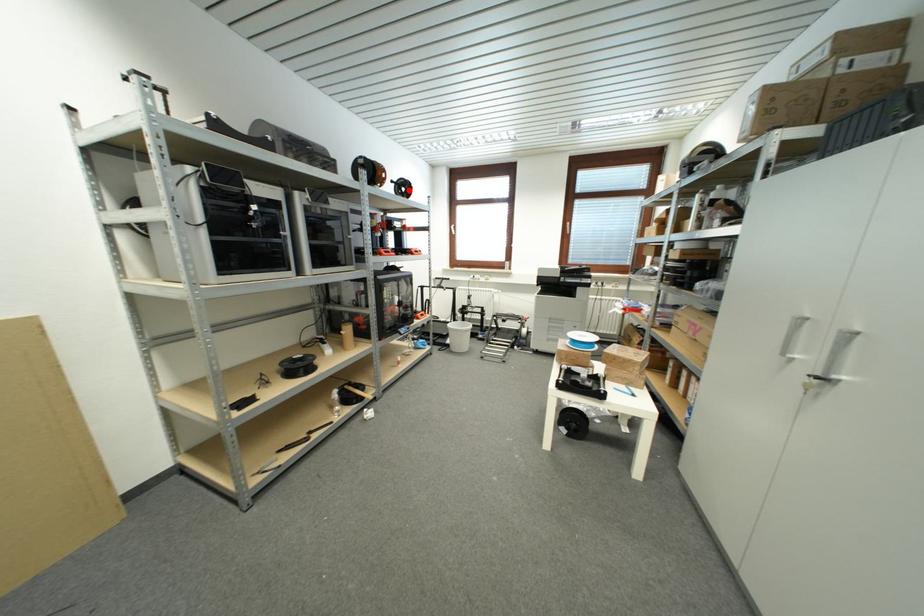
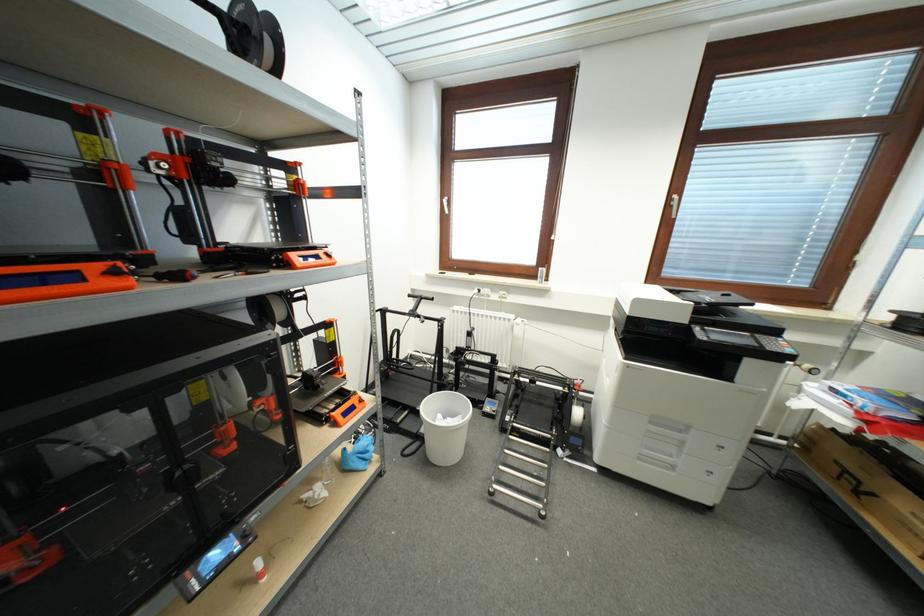
Question: I am providing you with two images of the same scene from different viewpoints. Image1 has a red point marked. In image2, the corresponding 3D location appears at what relative position? Reply with the corresponding letter.

Choices:
 (A) Closer
 (B) Farther

Answer: (B)